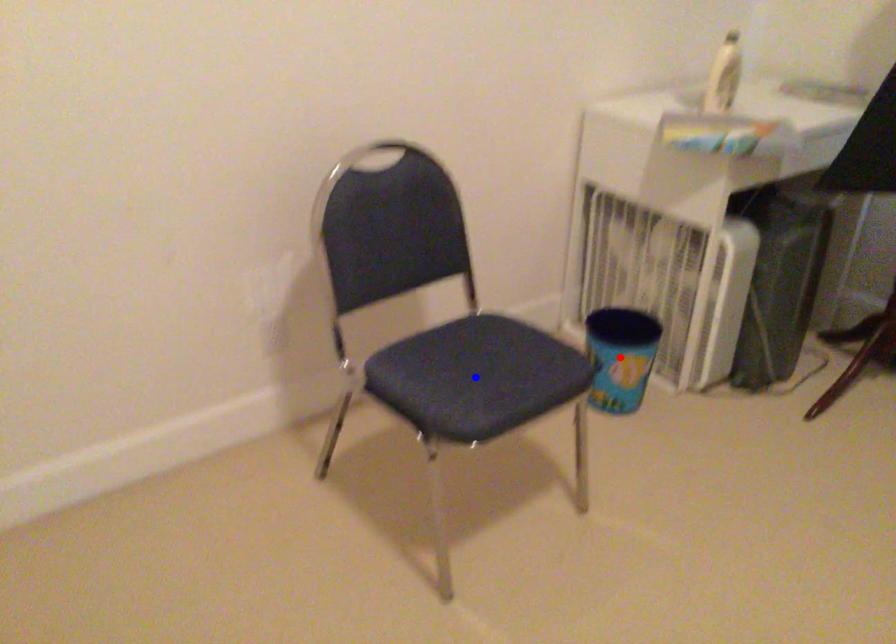
Question: Two points are marked on the image. Which point is closer to the camera?

Choices:
 (A) Blue point is closer.
 (B) Red point is closer.

Answer: (A)